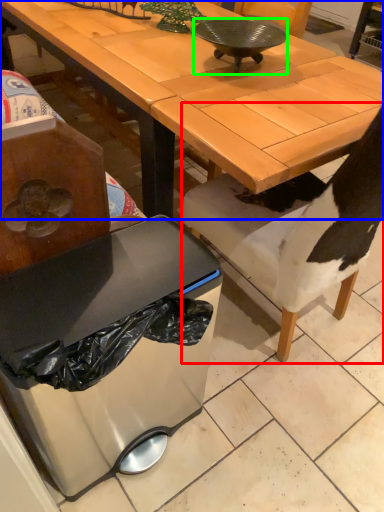
Question: Which object is positioned closest to chair (highlighted by a red box)? Select from desk (highlighted by a blue box) and bowl (highlighted by a green box).

Choices:
 (A) desk
 (B) bowl

Answer: (A)